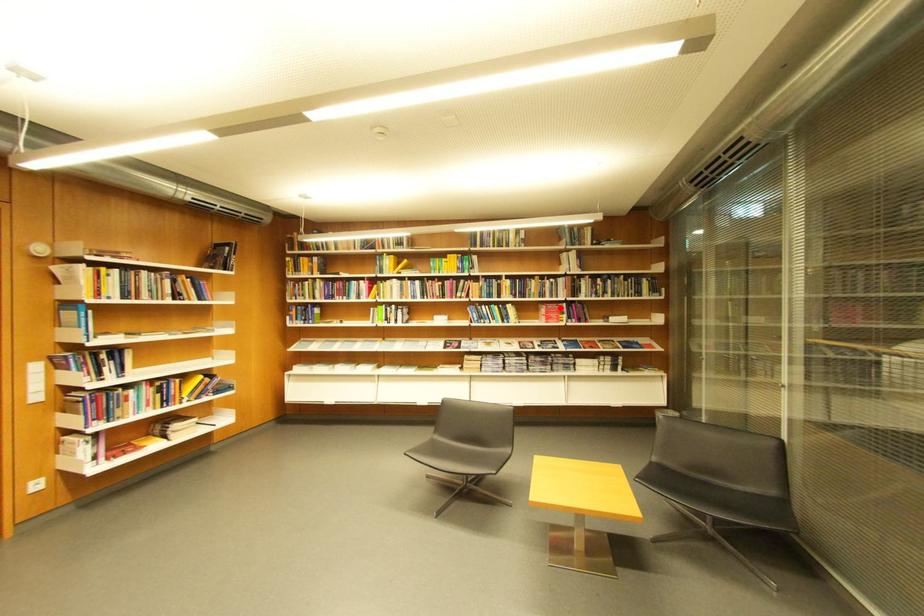
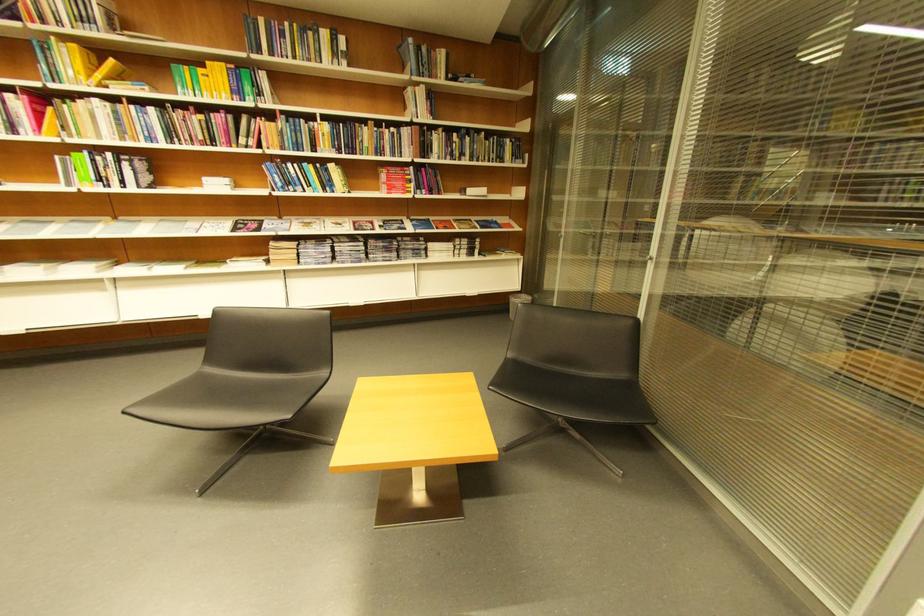
In the second image, find the point that corresponds to the highlighted location in the first image.

(403, 172)